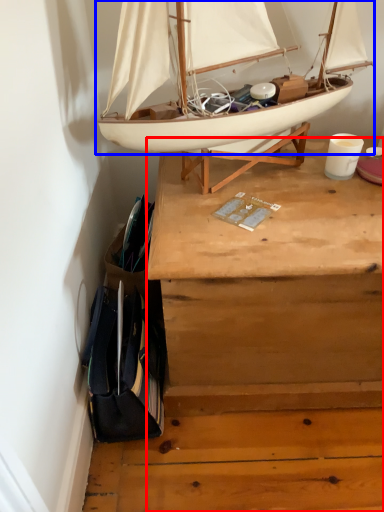
Question: Which object is further to the camera taking this photo, desk (highlighted by a red box) or boat (highlighted by a blue box)?

Choices:
 (A) desk
 (B) boat

Answer: (A)